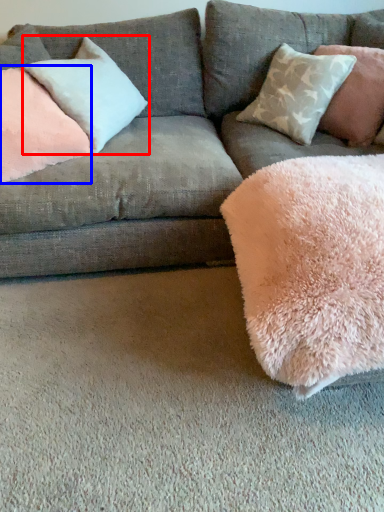
Question: Which point is closer to the camera, pillow (highlighted by a red box) or pillow (highlighted by a blue box)?

Choices:
 (A) pillow
 (B) pillow

Answer: (B)